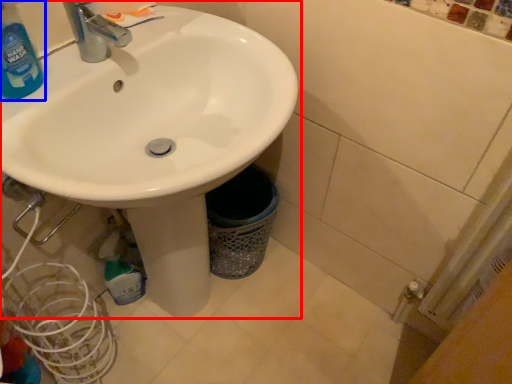
Question: Which object appears farthest to the camera in this image, sink (highlighted by a red box) or cleaning product (highlighted by a blue box)?

Choices:
 (A) sink
 (B) cleaning product

Answer: (B)